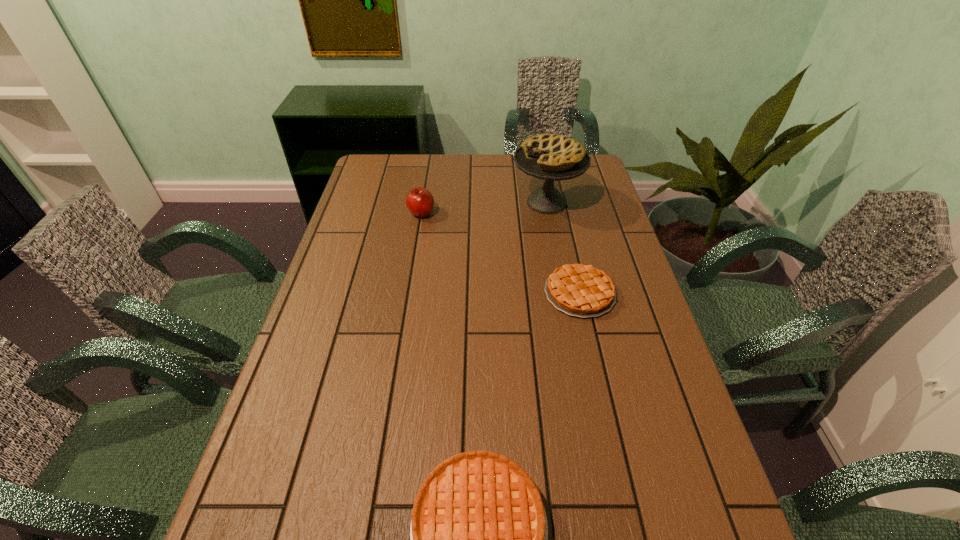
Where is `vacant space located on the left of the third farthest object`? Image resolution: width=960 pixels, height=540 pixels. vacant space located on the left of the third farthest object is located at coordinates (460, 293).

This screenshot has height=540, width=960. In order to click on object positioned at the far edge in this screenshot , I will do `click(550, 157)`.

I want to click on object positioned at the far right corner, so click(x=550, y=157).

In the image, there is a desktop. What are the coordinates of `free region at the far edge` in the screenshot? It's located at (488, 157).

Find the location of a particular element. free spot at the left edge of the desktop is located at coordinates (316, 403).

Image resolution: width=960 pixels, height=540 pixels. Identify the location of free space at the right edge of the desktop. (619, 372).

The height and width of the screenshot is (540, 960). In the image, there is a desktop. What are the coordinates of `vacant area at the far left corner` in the screenshot? It's located at (372, 165).

Identify the location of free space between the second nearest pie and the tallest object. The height and width of the screenshot is (540, 960). click(564, 248).

Locate an element on the screen. The image size is (960, 540). free space between the leftmost object and the shortest pie is located at coordinates tap(500, 253).

In order to click on free space that is in between the third farthest object and the second tallest object in this screenshot , I will do click(x=500, y=253).